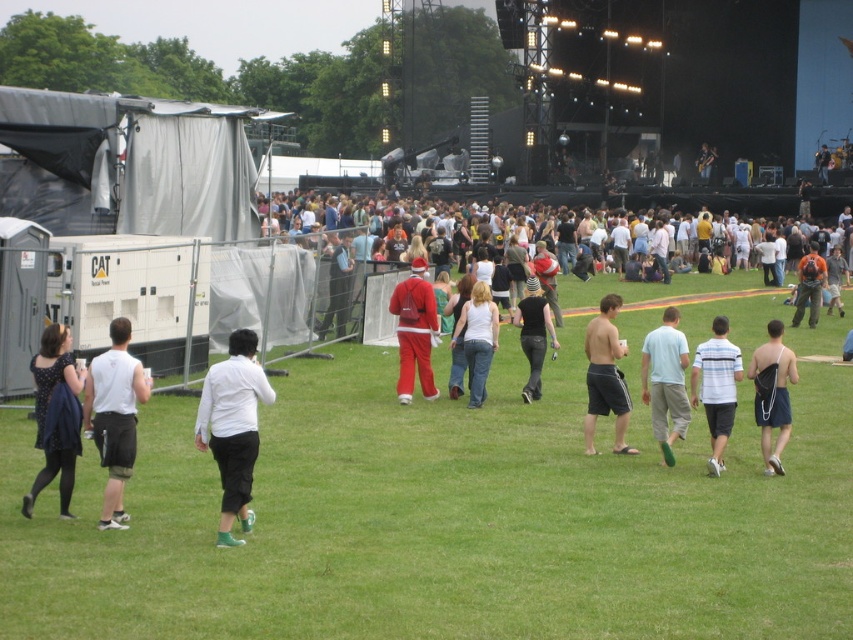
Question: Is light blue cotton shirt at center above matte red santa suit at center?

Choices:
 (A) no
 (B) yes

Answer: (A)

Question: Does white matte shirt at center have a greater width compared to white matte tank top at left?

Choices:
 (A) no
 (B) yes

Answer: (A)

Question: Is polka dot dress at lower left positioned behind orange fabric backpack at right?

Choices:
 (A) yes
 (B) no

Answer: (B)

Question: Which object is the farthest from the white striped t-shirt at center?

Choices:
 (A) matte red santa suit at center
 (B) black matte pants at center

Answer: (A)

Question: Which object is farther from the camera taking this photo?

Choices:
 (A) polka dot dress at lower left
 (B) matte red santa suit at center
 (C) black fabric bag at center-right

Answer: (B)

Question: Which object is positioned farthest from the white matte tank top at left?

Choices:
 (A) white cotton shirt at center
 (B) white matte shirt at center

Answer: (A)